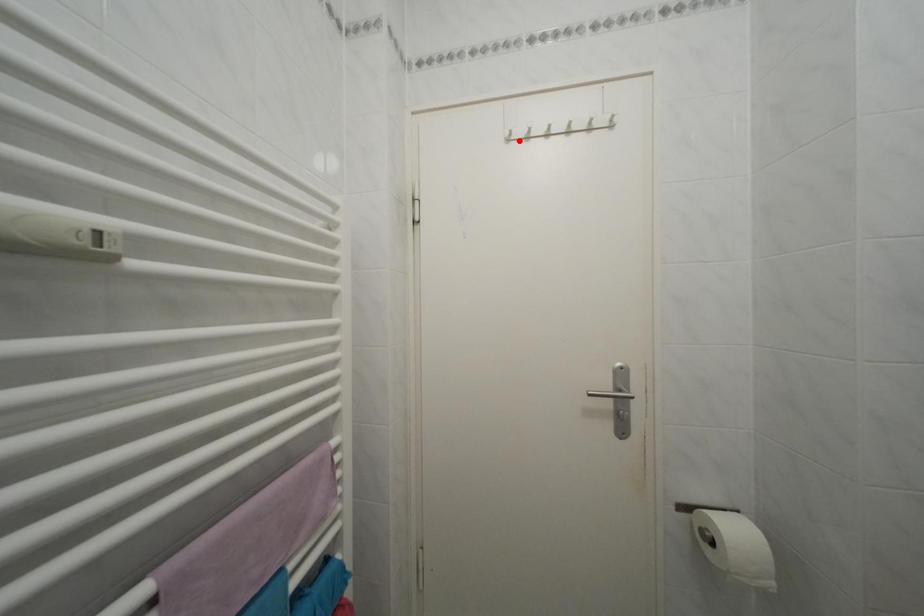
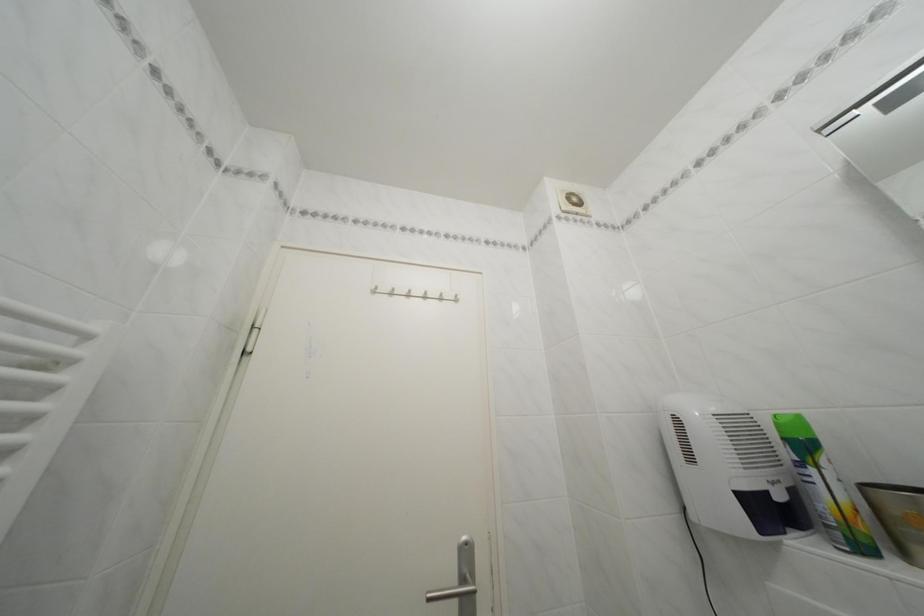
Locate, in the second image, the point that corresponds to the highlighted location in the first image.

(385, 294)